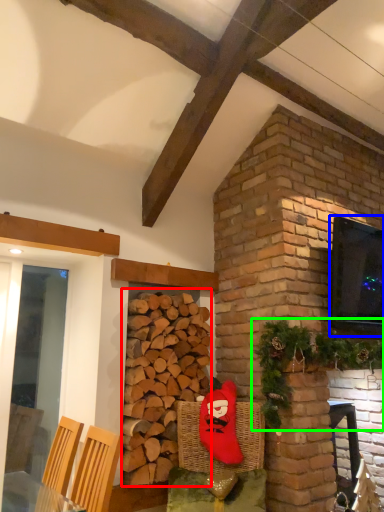
Question: Estimate the real-world distances between objects in this image. Which object is closer to brickwork (highlighted by a red box), window screen (highlighted by a blue box) or christmas decoration (highlighted by a green box)?

Choices:
 (A) window screen
 (B) christmas decoration

Answer: (B)